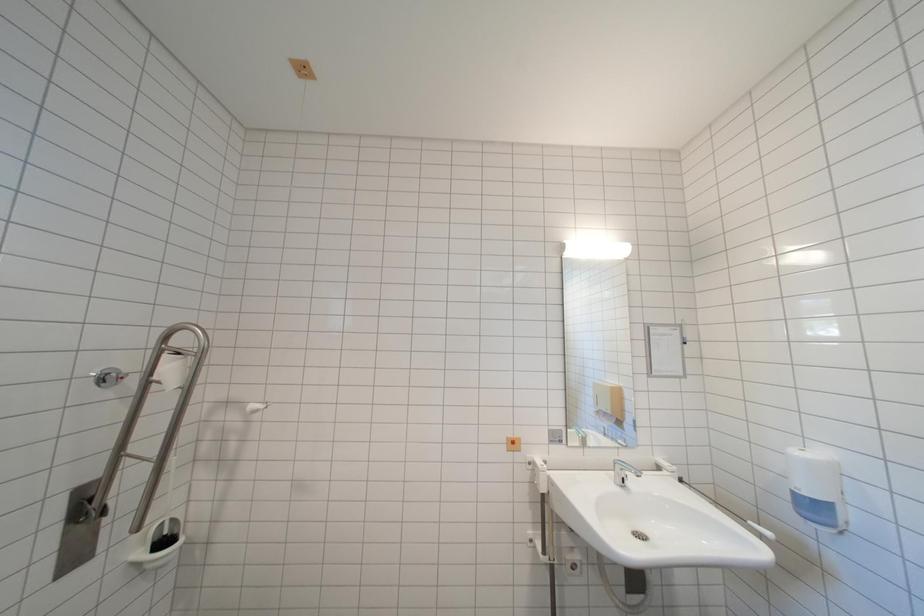
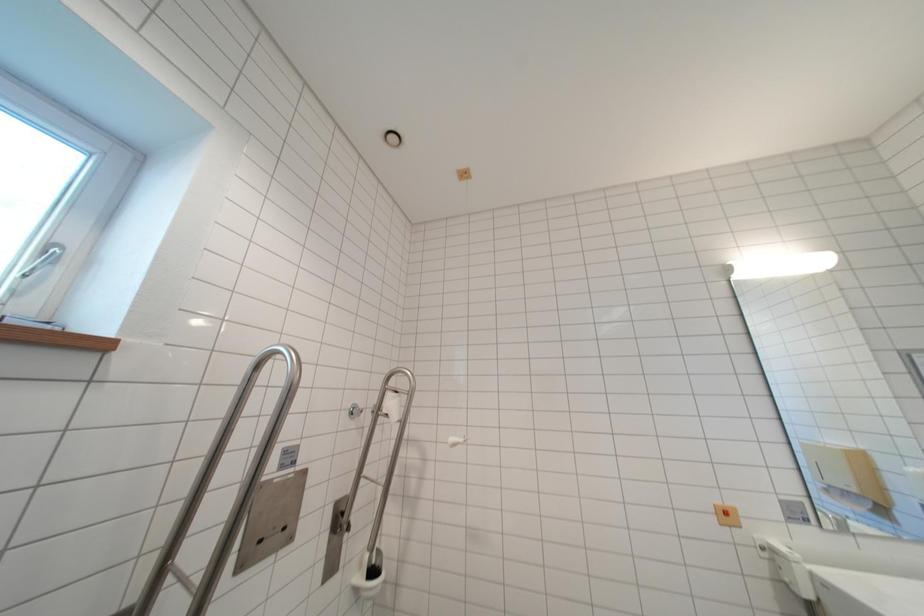
What movement of the cameraman would produce the second image?

The cameraman walked toward left, backward.